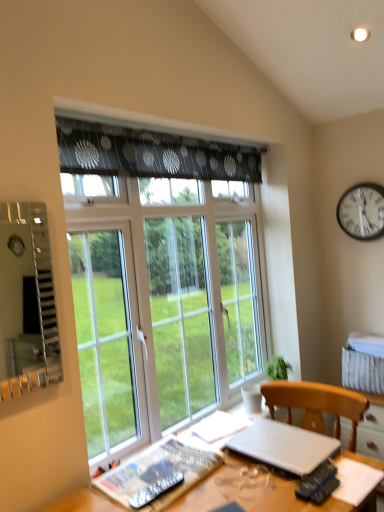
Describe the element at coordinates (161, 277) in the screenshot. The width and height of the screenshot is (384, 512). I see `transparent glass window at center` at that location.

Describe the element at coordinates (284, 446) in the screenshot. Image resolution: width=384 pixels, height=512 pixels. I see `silver metallic laptop at lower right` at that location.

Identify the location of black metal clock at upper right. (362, 211).

The width and height of the screenshot is (384, 512). I want to click on wooden desk at lower center, so click(254, 492).

Considering the positions of objects black metal clock at upper right and wooden desk at lower center in the image provided, who is more to the right, black metal clock at upper right or wooden desk at lower center?

black metal clock at upper right is more to the right.

Is black metal clock at upper right positioned with its back to wooden desk at lower center?

No, wooden desk at lower center is not at the back of black metal clock at upper right.

Can you confirm if metallic silver remote at lower center is wider than black metal clock at upper right?

Yes, metallic silver remote at lower center is wider than black metal clock at upper right.

How many degrees apart are the facing directions of metallic silver remote at lower center and black metal clock at upper right?

There is a 78-degree angle between the facing directions of metallic silver remote at lower center and black metal clock at upper right.

Is metallic silver remote at lower center far away from black metal clock at upper right?

metallic silver remote at lower center is positioned a significant distance from black metal clock at upper right.

Considering their positions, is metallic silver remote at lower center located in front of or behind black metal clock at upper right?

Clearly, metallic silver remote at lower center is in front of black metal clock at upper right.

Is black metal clock at upper right touching transparent glass window at center?

No, black metal clock at upper right is not making contact with transparent glass window at center.

Considering the relative sizes of black metal clock at upper right and transparent glass window at center in the image provided, is black metal clock at upper right thinner than transparent glass window at center?

Yes.

Considering the sizes of objects black metal clock at upper right and transparent glass window at center in the image provided, who is shorter, black metal clock at upper right or transparent glass window at center?

black metal clock at upper right.

Can you confirm if silver metallic laptop at lower right is positioned to the left of transparent glass window at center?

No, silver metallic laptop at lower right is not to the left of transparent glass window at center.

In terms of width, does silver metallic laptop at lower right look wider or thinner when compared to transparent glass window at center?

Considering their sizes, silver metallic laptop at lower right looks broader than transparent glass window at center.

In the scene shown: Considering the positions of objects wooden desk at lower center and black metal clock at upper right in the image provided, who is in front, wooden desk at lower center or black metal clock at upper right?

wooden desk at lower center is in front.

Is wooden desk at lower center outside of black metal clock at upper right?

Absolutely, wooden desk at lower center is external to black metal clock at upper right.

Is wooden desk at lower center facing towards black metal clock at upper right?

No, wooden desk at lower center does not turn towards black metal clock at upper right.

Which is closer, (215, 482) or (348, 191)?

Point (215, 482) is closer to the camera than point (348, 191).

This screenshot has width=384, height=512. I want to click on laptop below the black metal clock at upper right (from the image's perspective), so click(284, 446).

From the picture: Is black metal clock at upper right located within silver metallic laptop at lower right?

No, silver metallic laptop at lower right does not contain black metal clock at upper right.

Is point (292, 467) positioned after point (373, 208)?

That is False.

Who is taller, silver metallic laptop at lower right or black metal clock at upper right?

black metal clock at upper right is taller.

Considering the positions of objects transparent glass window at center and wooden desk at lower center in the image provided, who is more to the left, transparent glass window at center or wooden desk at lower center?

transparent glass window at center is more to the left.

Find the location of a particular element. desk that is in front of the transparent glass window at center is located at coordinates (254, 492).

Is transparent glass window at center next to wooden desk at lower center?

No, transparent glass window at center is not touching wooden desk at lower center.

The height and width of the screenshot is (512, 384). In order to click on clock behind the wooden desk at lower center in this screenshot , I will do `click(362, 211)`.

Find the location of a particular element. remote in front of the black metal clock at upper right is located at coordinates (156, 490).

Consider the image. Looking at the image, which one is located closer to transparent glass window at center, wooden desk at lower center or silver metallic laptop at lower right?

Based on the image, silver metallic laptop at lower right appears to be nearer to transparent glass window at center.

When comparing their distances from transparent glass window at center, does wooden desk at lower center or black metal clock at upper right seem further?

Based on the image, black metal clock at upper right appears to be further to transparent glass window at center.

Looking at the image, which one is located further to wooden desk at lower center, silver metallic laptop at lower right or metallic silver remote at lower center?

metallic silver remote at lower center is positioned further to the anchor wooden desk at lower center.

Considering their positions, is transparent glass window at center positioned further to black metal clock at upper right than silver metallic laptop at lower right?

silver metallic laptop at lower right is further to black metal clock at upper right.

Which object lies nearer to the anchor point transparent glass window at center, silver metallic laptop at lower right or black metal clock at upper right?

silver metallic laptop at lower right.

Based on their spatial positions, is transparent glass window at center or black metal clock at upper right closer to wooden desk at lower center?

Among the two, transparent glass window at center is located nearer to wooden desk at lower center.

Considering their positions, is black metal clock at upper right positioned closer to silver metallic laptop at lower right than transparent glass window at center?

transparent glass window at center.

Considering their positions, is transparent glass window at center positioned further to metallic silver remote at lower center than wooden desk at lower center?

The object further to metallic silver remote at lower center is transparent glass window at center.

The image size is (384, 512). What are the coordinates of `remote that lies between transparent glass window at center and wooden desk at lower center from top to bottom` in the screenshot? It's located at (156, 490).

At what (x,y) coordinates should I click in order to perform the action: click on window positioned between metallic silver remote at lower center and black metal clock at upper right from near to far. Please return your answer as a coordinate pair (x, y). The image size is (384, 512). Looking at the image, I should click on [161, 277].

Identify the location of window between wooden desk at lower center and black metal clock at upper right from front to back. (161, 277).

Identify the location of laptop between transparent glass window at center and wooden desk at lower center in the up-down direction. (284, 446).